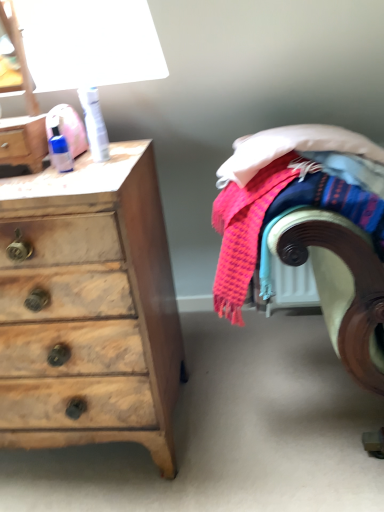
What are the coordinates of `vacant space to the right of wooden chest of drawers at left` in the screenshot? It's located at (259, 398).